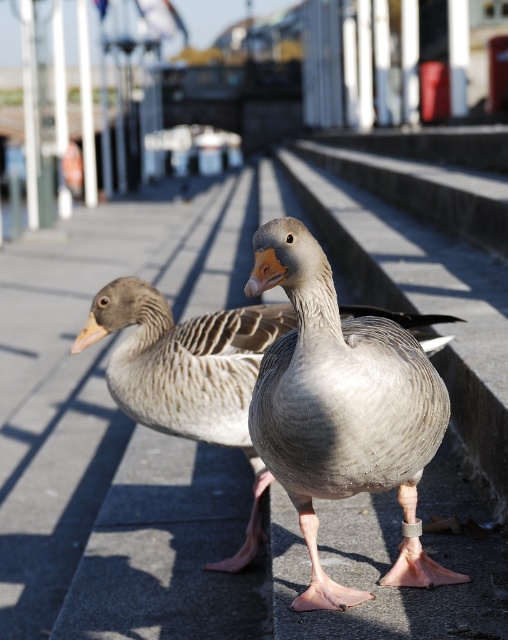
Question: Which of the following is the farthest from the observer?

Choices:
 (A) gray feathered goose at center
 (B) gray matte duck at center

Answer: (B)

Question: Which object appears farthest from the camera in this image?

Choices:
 (A) gray matte duck at center
 (B) gray feathered goose at center

Answer: (A)

Question: Can you confirm if gray feathered goose at center is bigger than gray matte duck at center?

Choices:
 (A) yes
 (B) no

Answer: (B)

Question: Where is gray feathered goose at center located in relation to gray matte duck at center in the image?

Choices:
 (A) above
 (B) below

Answer: (A)

Question: Does gray feathered goose at center appear on the left side of gray matte duck at center?

Choices:
 (A) yes
 (B) no

Answer: (B)